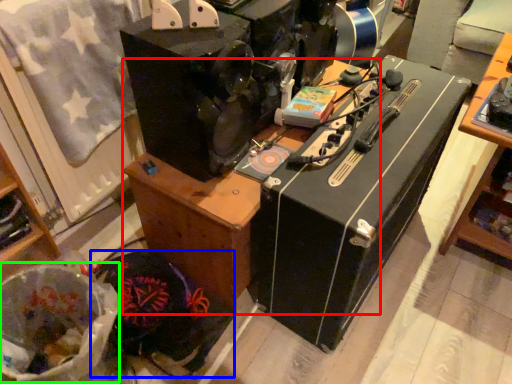
Question: Which is nearer to the furniture (highlighted by a red box)? waste (highlighted by a blue box) or waste (highlighted by a green box).

Choices:
 (A) waste
 (B) waste

Answer: (A)